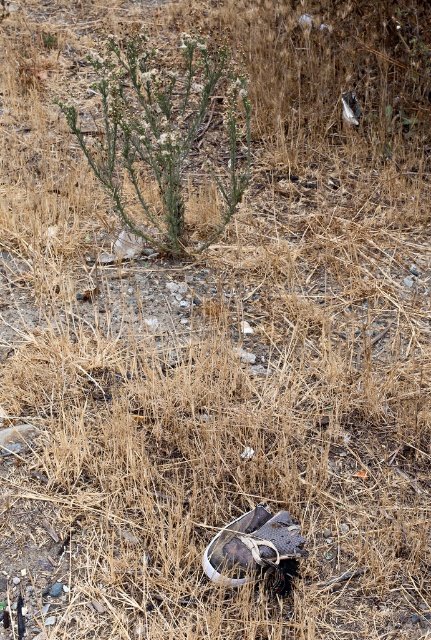
Is green leafy plant at center wider than white leather shoe at center?

Yes, green leafy plant at center is wider than white leather shoe at center.

I want to click on green leafy plant at center, so click(x=162, y=134).

What are the coordinates of `green leafy plant at center` in the screenshot? It's located at (162, 134).

The image size is (431, 640). What are the coordinates of `green leafy plant at center` in the screenshot? It's located at (162, 134).